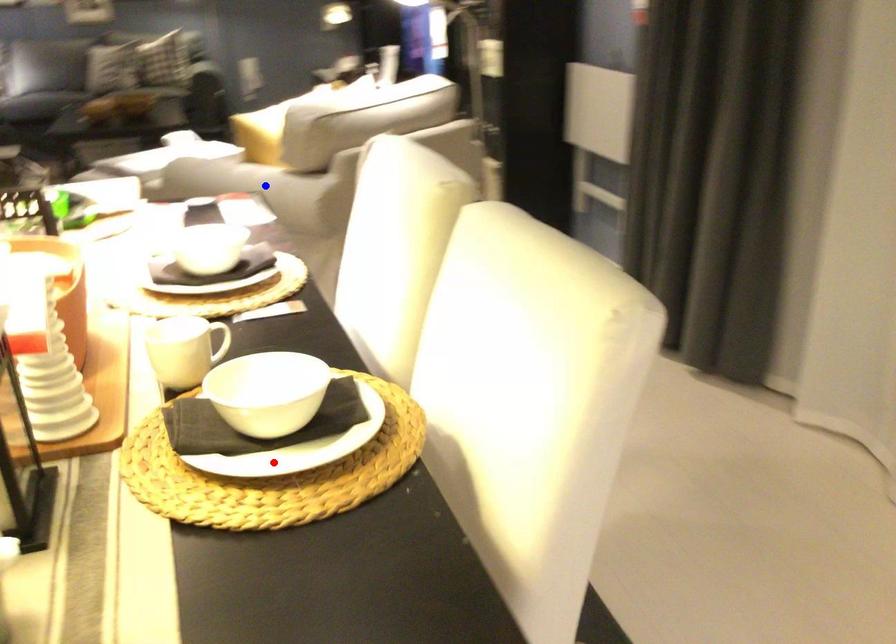
Question: In the image, two points are highlighted. Which point is nearer to the camera? Reply with the corresponding letter.

Choices:
 (A) blue point
 (B) red point

Answer: (B)